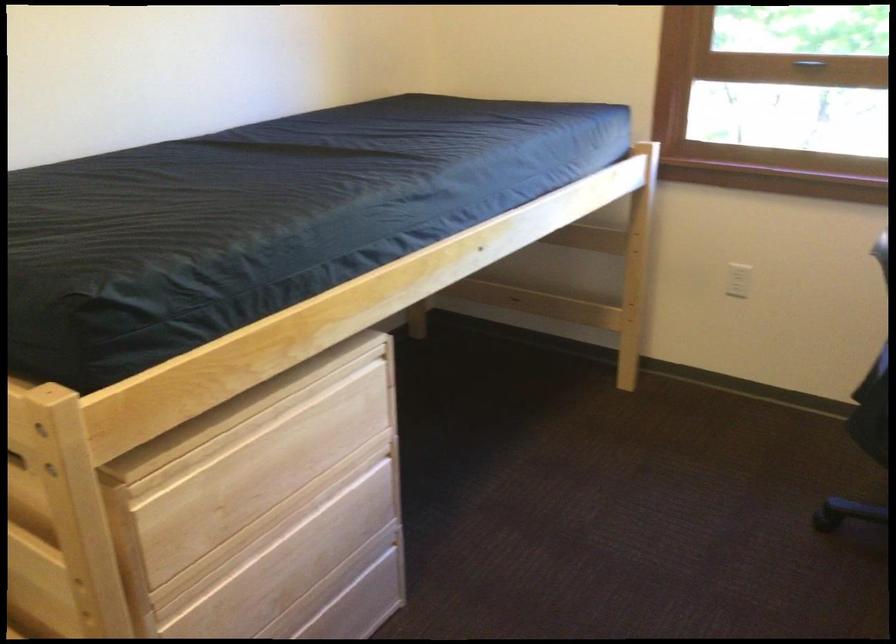
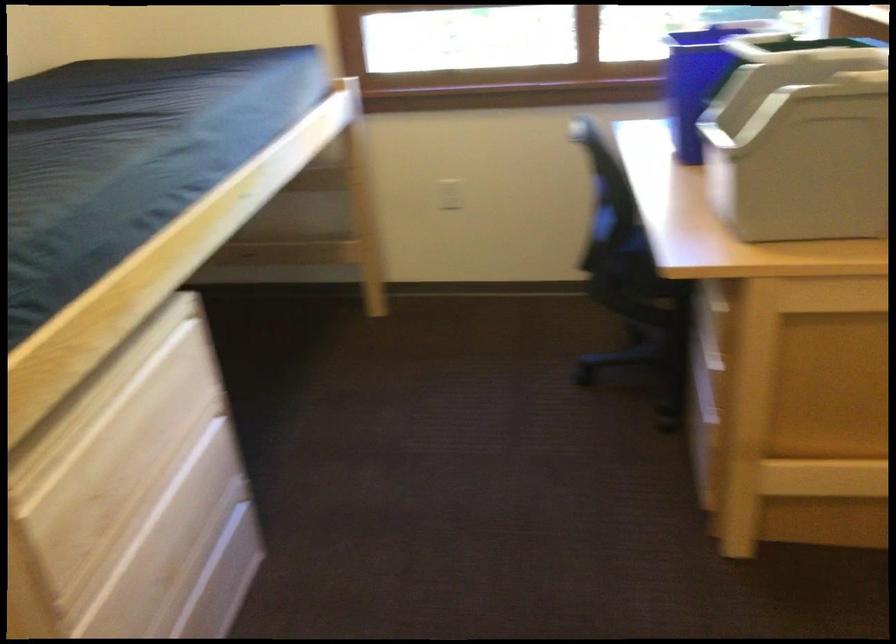
Question: In a continuous first-person perspective shot, in which direction is the camera moving?

Choices:
 (A) Left
 (B) Right
 (C) Forward
 (D) Backward

Answer: (A)